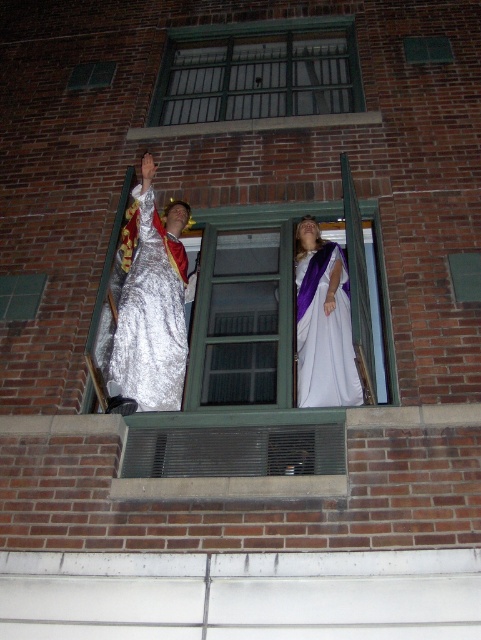
You are a photographer trying to capture the clear glass window at center and the white satin dress at center in the same frame. Based on their sizes, which object will appear taller in the photo?

The clear glass window at center will appear taller in the photo because it has a greater height compared to the white satin dress at center.

You are a security guard assigned to monitor the building with the open window. You notice a point at coordinates [257,72] on the building. What object is located at that point?

The point at coordinates [257,72] indicates green metal bars at upper center.